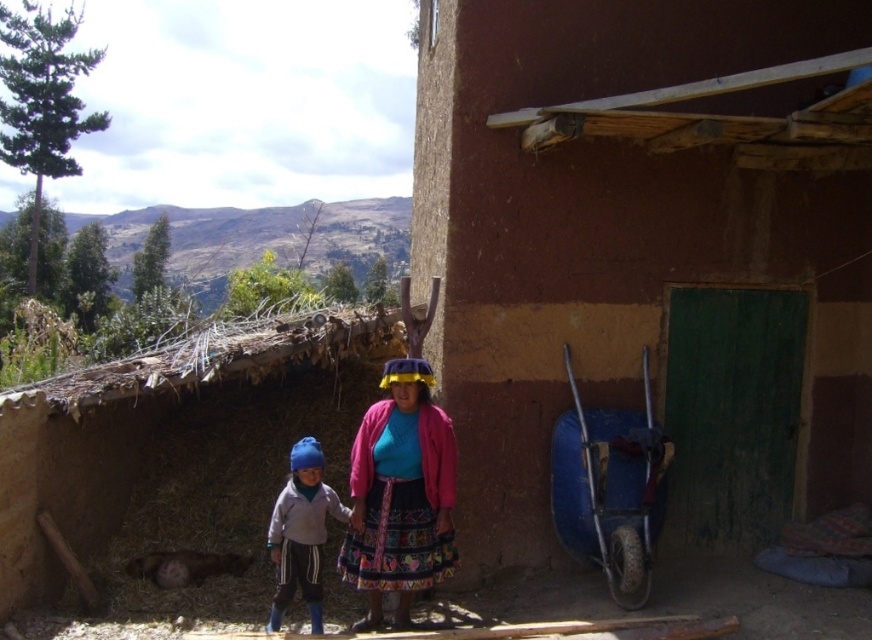
Where is `brown mud hut at right`? The image size is (872, 640). brown mud hut at right is located at coordinates (646, 252).

Consider the image. Does brown mud hut at right have a larger size compared to matte blue hat at lower left?

Yes.

Does point (784, 496) come behind point (317, 500)?

Yes, point (784, 496) is farther from viewer.

Find the location of a particular element. The width and height of the screenshot is (872, 640). brown mud hut at right is located at coordinates (646, 252).

Is matte pink sweater at center above matte blue hat at lower left?

Yes.

Between matte pink sweater at center and matte blue hat at lower left, which one is positioned lower?

Positioned lower is matte blue hat at lower left.

This screenshot has width=872, height=640. What are the coordinates of `matte pink sweater at center` in the screenshot? It's located at (400, 493).

Find the location of `matte pink sweater at center`. matte pink sweater at center is located at coordinates (400, 493).

Can you confirm if brown mud hut at right is thinner than matte pink sweater at center?

In fact, brown mud hut at right might be wider than matte pink sweater at center.

Who is lower down, brown mud hut at right or matte pink sweater at center?

matte pink sweater at center

Identify the location of brown mud hut at right. (646, 252).